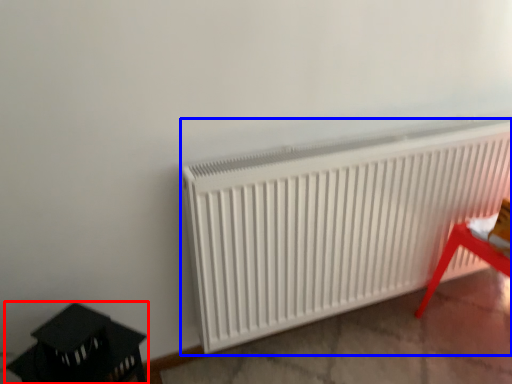
Question: Which point is further to the camera, furniture (highlighted by a red box) or radiator (highlighted by a blue box)?

Choices:
 (A) furniture
 (B) radiator

Answer: (B)